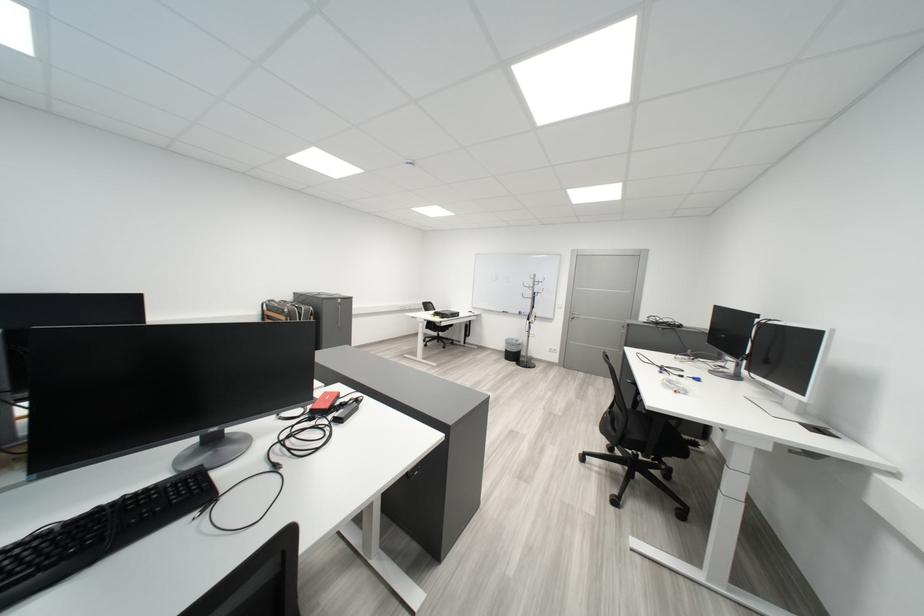
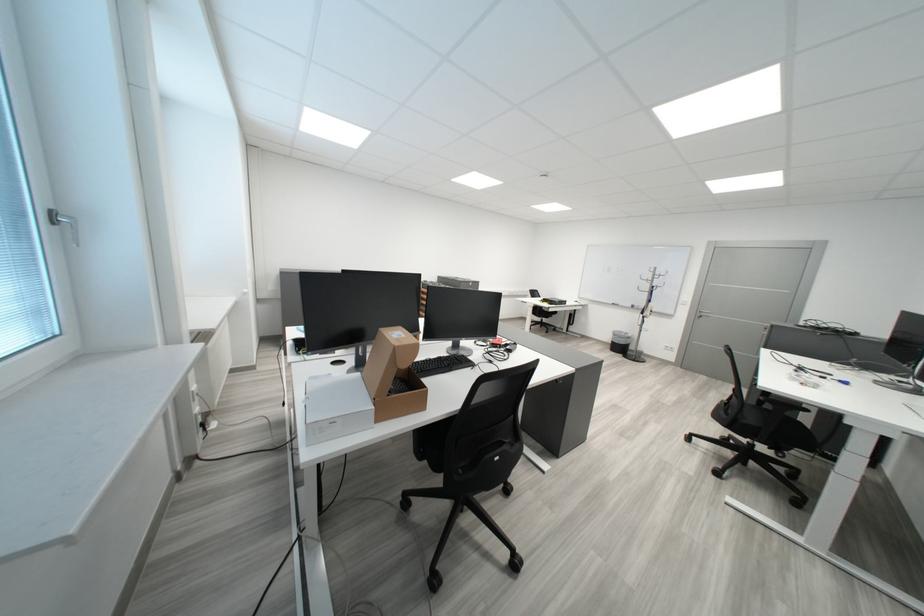
Locate, in the second image, the point that corresponds to (x=520, y=344) in the first image.

(627, 336)